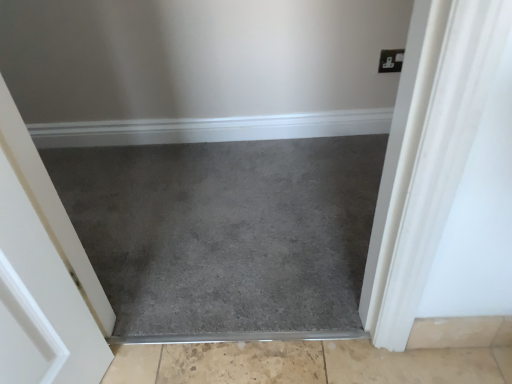
Question: Is slate carpet at center bigger than beige textured concrete at bottom, positioned as the 2th concrete in top-to-bottom order?

Choices:
 (A) yes
 (B) no

Answer: (A)

Question: Does slate carpet at center have a greater height compared to beige textured concrete at bottom, positioned as the 2th concrete in top-to-bottom order?

Choices:
 (A) no
 (B) yes

Answer: (B)

Question: Is slate carpet at center next to beige textured concrete at bottom, positioned as the 2th concrete in top-to-bottom order, and touching it?

Choices:
 (A) no
 (B) yes

Answer: (A)

Question: Is the position of slate carpet at center less distant than that of beige textured concrete at bottom, the 1th concrete in the bottom-to-top sequence?

Choices:
 (A) yes
 (B) no

Answer: (B)

Question: Is slate carpet at center turned away from beige textured concrete at bottom, the 1th concrete in the bottom-to-top sequence?

Choices:
 (A) yes
 (B) no

Answer: (B)

Question: From a real-world perspective, is slate carpet at center physically below beige textured concrete at bottom, positioned as the 2th concrete in top-to-bottom order?

Choices:
 (A) no
 (B) yes

Answer: (A)

Question: Is beige tile at lower right, which ranks as the second concrete in bottom-to-top order, completely or partially inside slate carpet at center?

Choices:
 (A) no
 (B) yes

Answer: (A)

Question: From a real-world perspective, is slate carpet at center on top of beige tile at lower right, which ranks as the second concrete in bottom-to-top order?

Choices:
 (A) yes
 (B) no

Answer: (B)

Question: Considering the relative sizes of slate carpet at center and beige tile at lower right, the 1th concrete in the top-to-bottom sequence, in the image provided, is slate carpet at center smaller than beige tile at lower right, the 1th concrete in the top-to-bottom sequence,?

Choices:
 (A) yes
 (B) no

Answer: (B)

Question: Is slate carpet at center bigger than beige tile at lower right, which ranks as the second concrete in bottom-to-top order?

Choices:
 (A) no
 (B) yes

Answer: (B)

Question: Is slate carpet at center wider than beige tile at lower right, which ranks as the second concrete in bottom-to-top order?

Choices:
 (A) yes
 (B) no

Answer: (A)

Question: Is slate carpet at center thinner than beige tile at lower right, which ranks as the second concrete in bottom-to-top order?

Choices:
 (A) no
 (B) yes

Answer: (A)

Question: From a real-world perspective, is beige textured concrete at bottom, positioned as the 2th concrete in top-to-bottom order, beneath slate carpet at center?

Choices:
 (A) yes
 (B) no

Answer: (A)